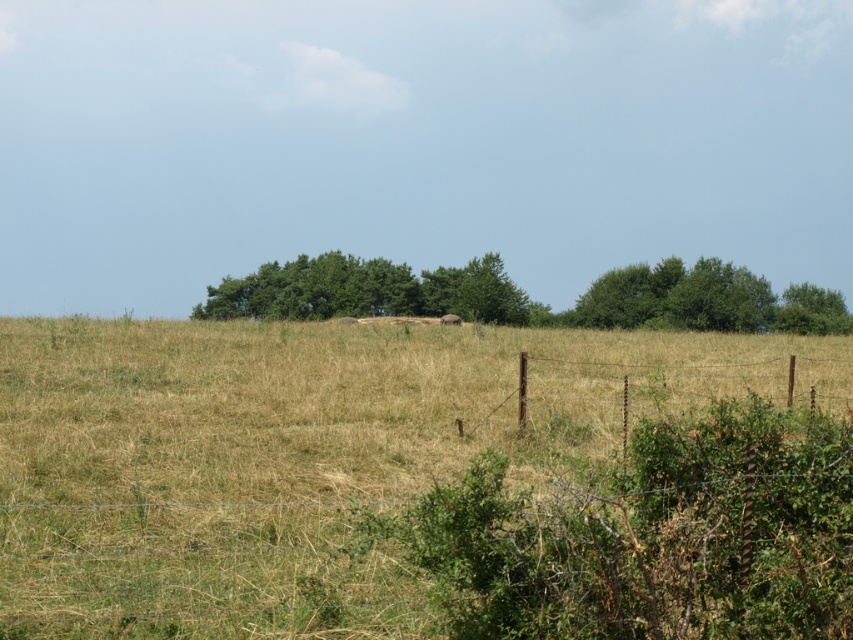
Question: Is dry grass at center thinner than green leafy trees at center?

Choices:
 (A) no
 (B) yes

Answer: (B)

Question: Which object is farther from the camera taking this photo?

Choices:
 (A) green leafy trees at center
 (B) green leafy tree at upper right

Answer: (A)

Question: Is dry grass at center smaller than green leafy tree at upper right?

Choices:
 (A) yes
 (B) no

Answer: (B)

Question: Is green leafy trees at center positioned behind green leafy tree at upper right?

Choices:
 (A) no
 (B) yes

Answer: (B)

Question: Among these objects, which one is farthest from the camera?

Choices:
 (A) green leafy tree at center
 (B) green leafy trees at center
 (C) dry grass at center
 (D) green leafy tree at upper right

Answer: (B)

Question: Which of the following is the farthest from the observer?

Choices:
 (A) (788, 326)
 (B) (722, 298)
 (C) (457, 273)
 (D) (376, 380)

Answer: (C)